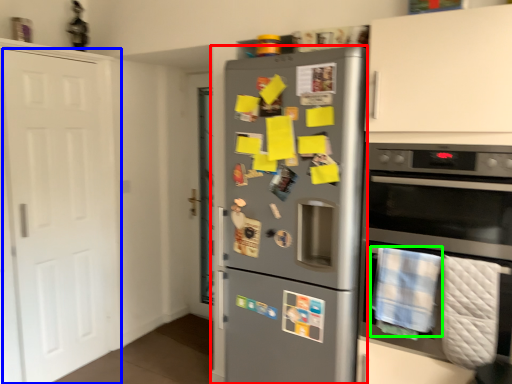
Question: Considering the real-world distances, which object is closest to refrigerator (highlighted by a red box)? door (highlighted by a blue box) or blanket (highlighted by a green box).

Choices:
 (A) door
 (B) blanket

Answer: (B)